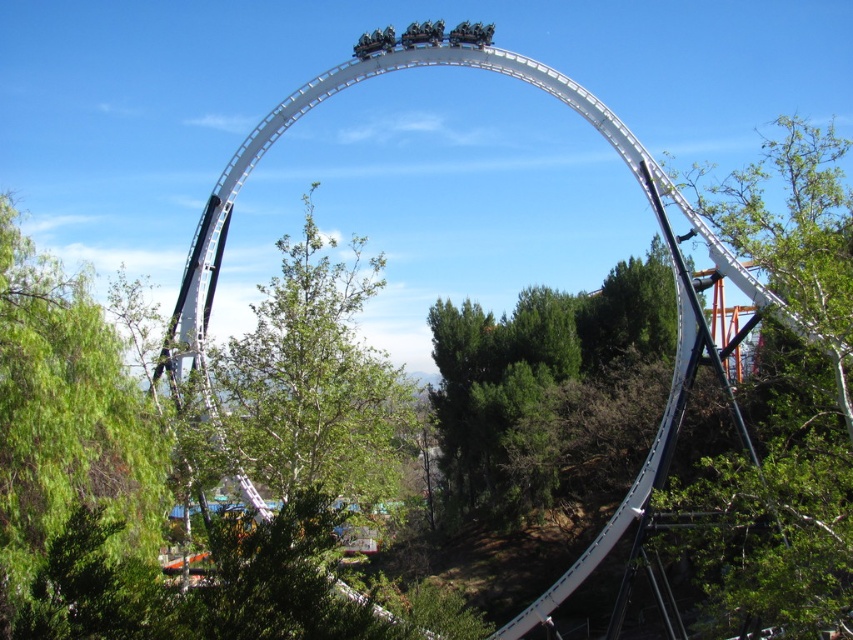
You are a photographer planning to capture both the green textured tree at center and the green leafy tree at center in a single shot. Based on their sizes, which tree would occupy more space in the photo?

The green textured tree at center would occupy more space in the photo because its width is larger than that of the green leafy tree at center.